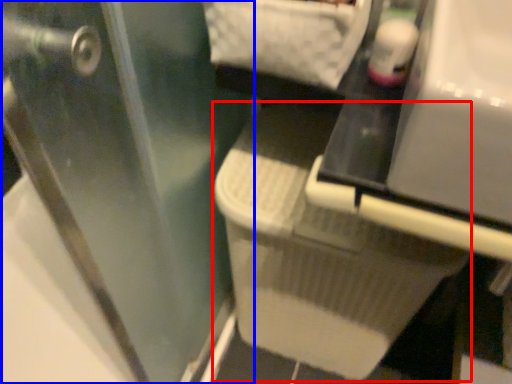
Question: Which object appears farthest to the camera in this image, laundry basket (highlighted by a red box) or screen door (highlighted by a blue box)?

Choices:
 (A) laundry basket
 (B) screen door

Answer: (A)